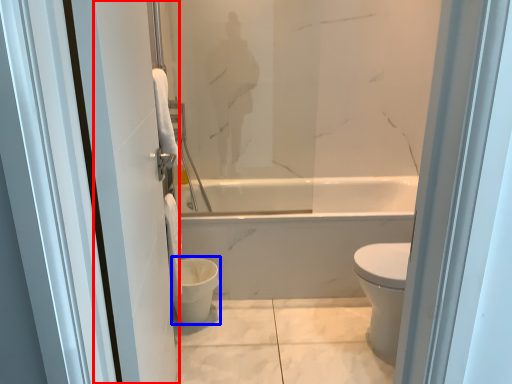
Question: Which object appears closest to the camera in this image, screen door (highlighted by a red box) or toilet bowl (highlighted by a blue box)?

Choices:
 (A) screen door
 (B) toilet bowl

Answer: (A)